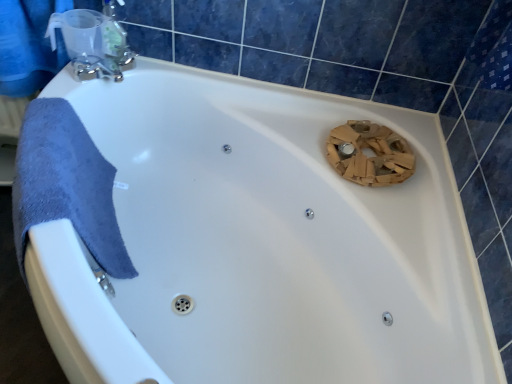
Question: Is satin nickel faucet at upper left taller than blue fabric towel at upper left?

Choices:
 (A) no
 (B) yes

Answer: (A)

Question: Considering the relative sizes of satin nickel faucet at upper left and blue fabric towel at upper left in the image provided, is satin nickel faucet at upper left shorter than blue fabric towel at upper left?

Choices:
 (A) no
 (B) yes

Answer: (B)

Question: Is there a large distance between satin nickel faucet at upper left and blue fabric towel at upper left?

Choices:
 (A) yes
 (B) no

Answer: (B)

Question: Can you confirm if satin nickel faucet at upper left is thinner than blue fabric towel at upper left?

Choices:
 (A) yes
 (B) no

Answer: (A)

Question: From the image's perspective, is satin nickel faucet at upper left beneath blue fabric towel at upper left?

Choices:
 (A) no
 (B) yes

Answer: (B)

Question: Is satin nickel faucet at upper left positioned in front of blue fabric towel at upper left?

Choices:
 (A) no
 (B) yes

Answer: (A)

Question: Would you consider clear plastic soap dispenser at upper left to be distant from satin nickel faucet at upper left?

Choices:
 (A) no
 (B) yes

Answer: (A)

Question: Is clear plastic soap dispenser at upper left behind satin nickel faucet at upper left?

Choices:
 (A) yes
 (B) no

Answer: (B)

Question: Is the position of clear plastic soap dispenser at upper left less distant than that of satin nickel faucet at upper left?

Choices:
 (A) no
 (B) yes

Answer: (B)

Question: Can satin nickel faucet at upper left be found inside clear plastic soap dispenser at upper left?

Choices:
 (A) yes
 (B) no

Answer: (B)

Question: Considering the relative sizes of clear plastic soap dispenser at upper left and satin nickel faucet at upper left in the image provided, is clear plastic soap dispenser at upper left shorter than satin nickel faucet at upper left?

Choices:
 (A) yes
 (B) no

Answer: (B)

Question: From a real-world perspective, is clear plastic soap dispenser at upper left below satin nickel faucet at upper left?

Choices:
 (A) no
 (B) yes

Answer: (A)

Question: Does blue fabric towel at upper left contain satin nickel faucet at upper left?

Choices:
 (A) no
 (B) yes

Answer: (A)